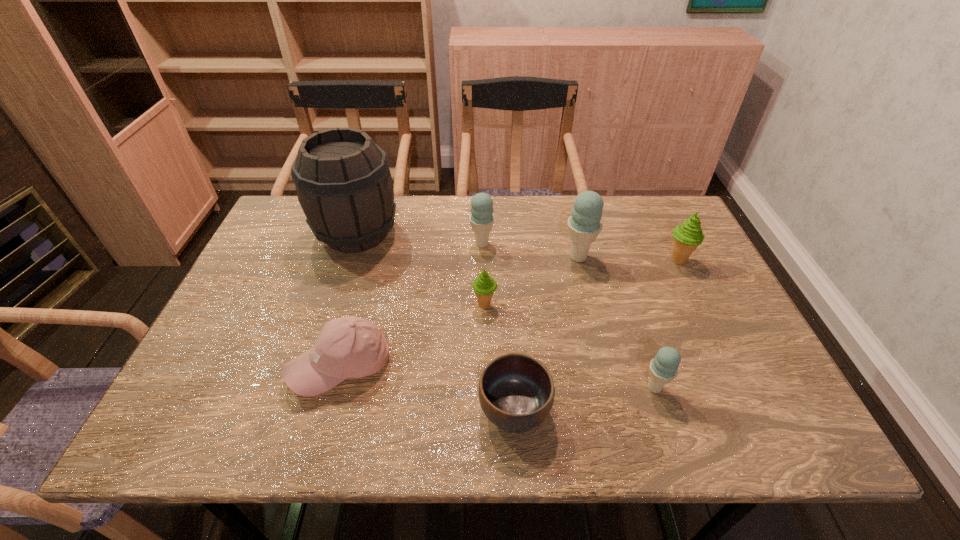
Locate an element on the screen. This screenshot has height=540, width=960. baseball cap is located at coordinates (349, 347).

Find the location of `bowl`. bowl is located at coordinates (516, 391).

Identify the location of free space located on the right of the wine bucket. The height and width of the screenshot is (540, 960). (457, 234).

Locate an element on the screen. The image size is (960, 540). vacant space located 0.240m on the front of the sixth object from left to right is located at coordinates (x=598, y=338).

You are a GUI agent. You are given a task and a screenshot of the screen. Output one action in this format:
    pyautogui.click(x=<x>, y=<y>)
    Task: Click on the free point located on the right of the second biggest blue ice cream
    The image size is (960, 540).
    Given the screenshot: What is the action you would take?
    pyautogui.click(x=512, y=244)

Identify the location of free space located 0.200m on the front of the right green icecream. [710, 328].

You are a GUI agent. You are given a task and a screenshot of the screen. Output one action in this format:
    pyautogui.click(x=<x>, y=<y>)
    Task: Click on the free region located 0.120m on the right of the nearest icecream
    This screenshot has width=960, height=540.
    Given the screenshot: What is the action you would take?
    pyautogui.click(x=724, y=388)

I want to click on vacant space located 0.350m on the back of the smaller green icecream, so click(x=484, y=215).

Locate an element on the screen. This screenshot has height=540, width=960. vacant space located on the right of the bowl is located at coordinates (717, 410).

In order to click on wine bucket present at the far edge in this screenshot , I will do `click(343, 182)`.